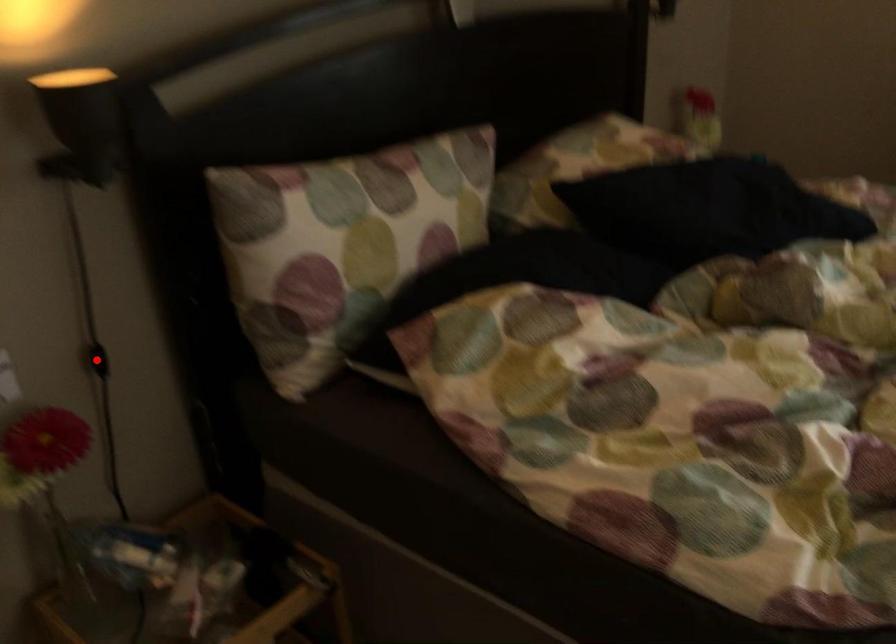
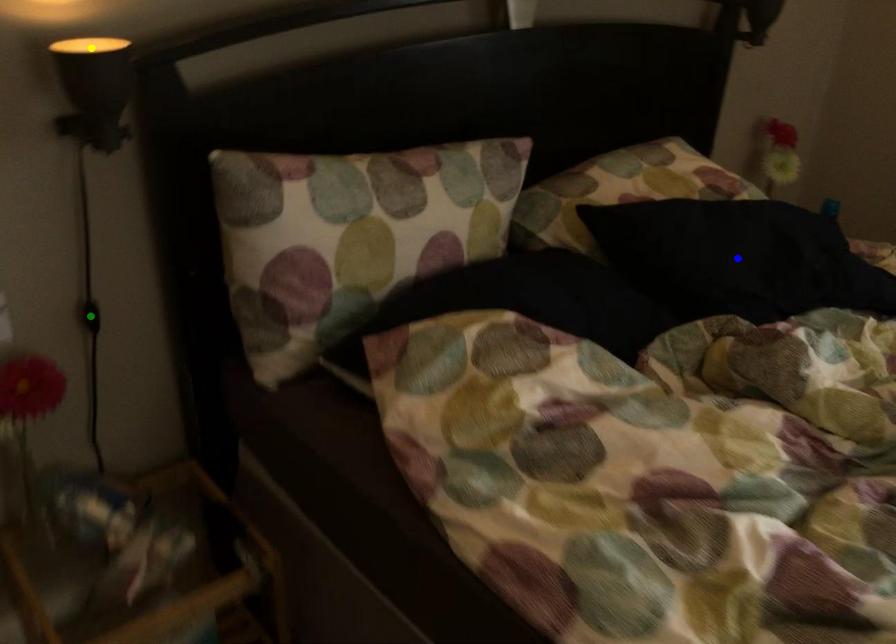
Question: I am providing you with two images of the same scene from different viewpoints. A red point is marked on the first image. You are given multiple points on the second image. Which spot in image 2 lines up with the point in image 1?

Choices:
 (A) green point
 (B) blue point
 (C) yellow point

Answer: (A)